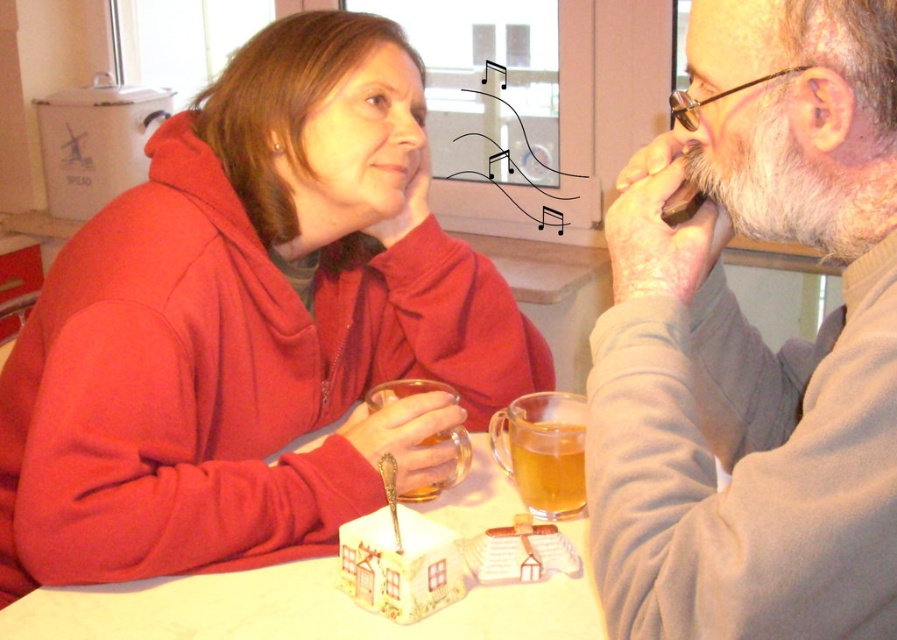
You are a photographer trying to capture a candid shot of the scene. You want to ensure the matte red hoodie at center and the translucent amber liquid at lower center are both clearly visible. Based on their positions, which object should you focus on first to ensure both are in frame?

The matte red hoodie at center is to the left of the translucent amber liquid at lower center, so focusing on the matte red hoodie at center first will allow you to frame both objects since it is positioned to the left side of the scene.